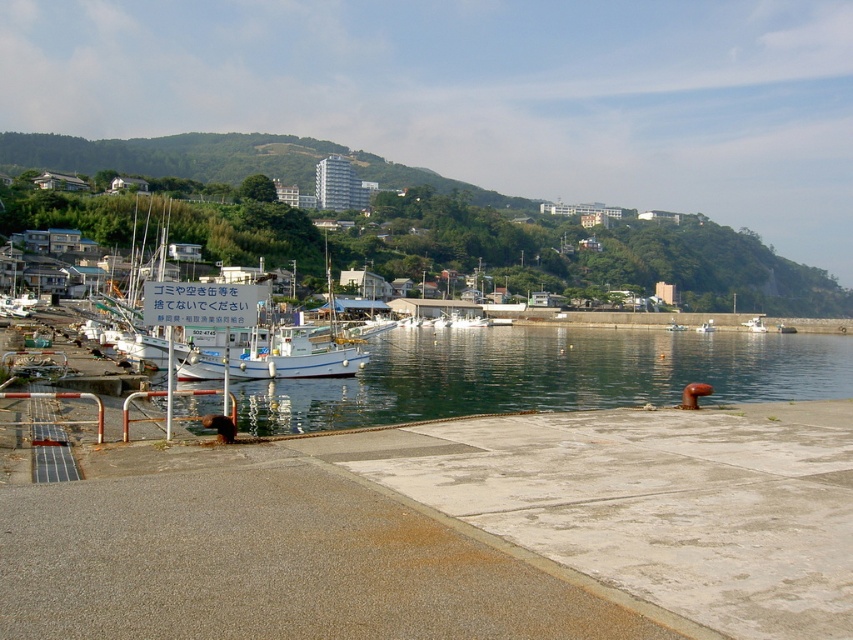
Is point (347, 394) positioned after point (788, 272)?

No, (347, 394) is in front of (788, 272).

Does clear water at dock center have a greater height compared to green grassy hillside at upper center?

No.

Find the location of a particular element. This screenshot has height=640, width=853. clear water at dock center is located at coordinates (544, 374).